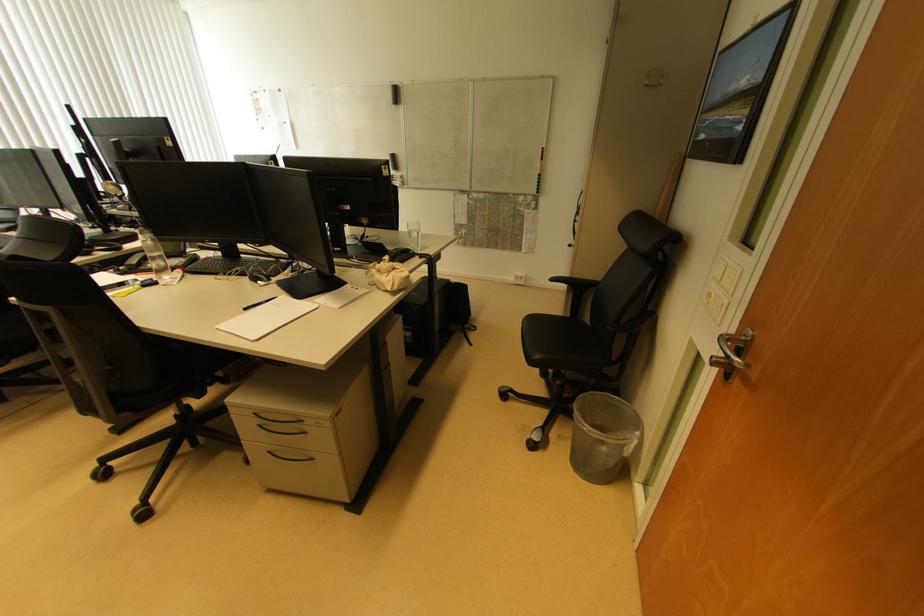
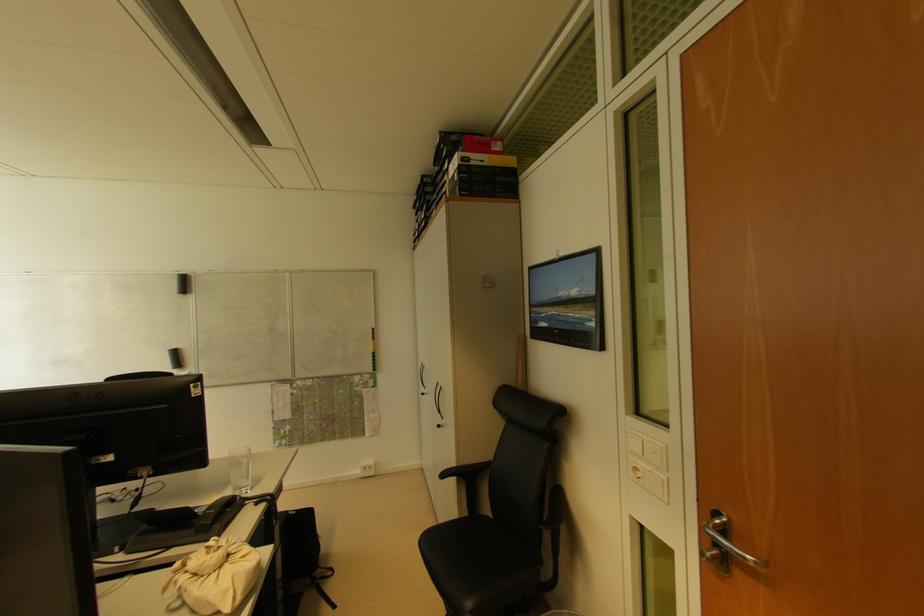
Find the pixel in the second image that matches pixel 748 344 in the first image.

(726, 527)